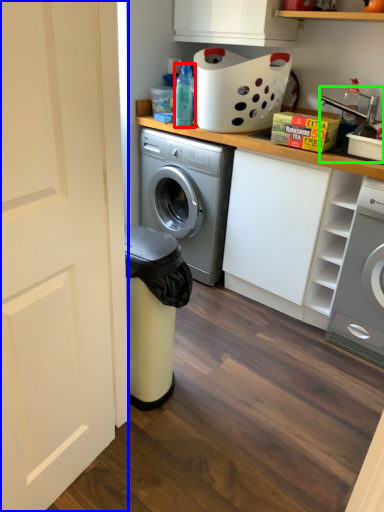
Question: Estimate the real-world distances between objects in this image. Which object is farther from bottle (highlighted by a red box), door (highlighted by a blue box) or sink (highlighted by a green box)?

Choices:
 (A) door
 (B) sink

Answer: (A)